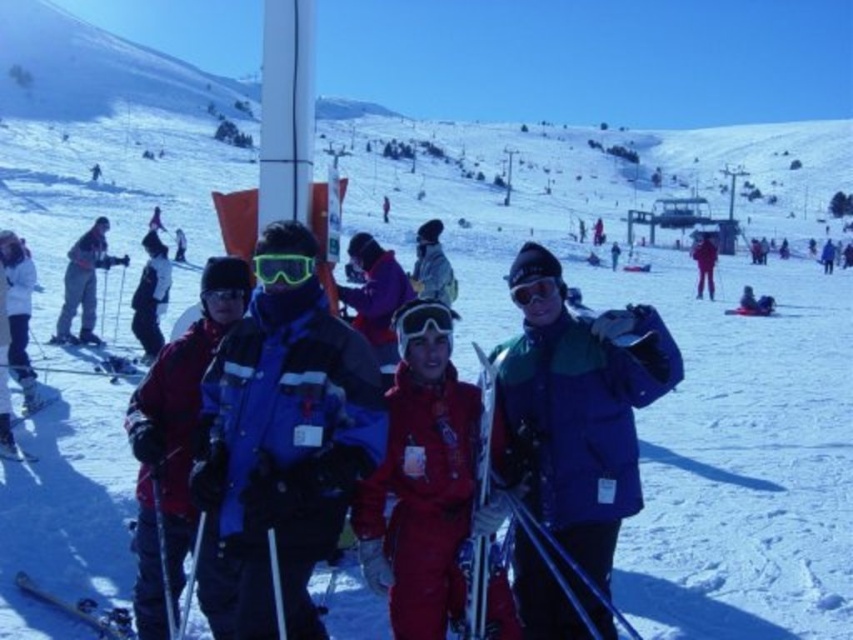
You are standing at the ski resort and want to determine which of the two points in the image is closer to you. The points are located at coordinates point (36, 404) and point (550, 282). Based on the scene description, which point is closer?

Point (36, 404) is closer to the viewer than point (550, 282) because it is described as further to the viewer in the objects description.

You are a photographer at the ski resort and want to capture a photo of the two items mentioned in the scene. You need to ensure that the green reflective goggles at center are positioned to the left of the matte black jacket at center in the final image. Based on their current arrangement, will this requirement be met?

Yes, the requirement will be met because the green reflective goggles at center are already positioned to the left of the matte black jacket at center as described in the scene.

You are a ski equipment inspector checking the dimensions of the white matte ski at lower left and the green reflective goggles at center. Which object has a smaller width?

The white matte ski at lower left is thinner than the green reflective goggles at center, so the white matte ski at lower left has a smaller width.